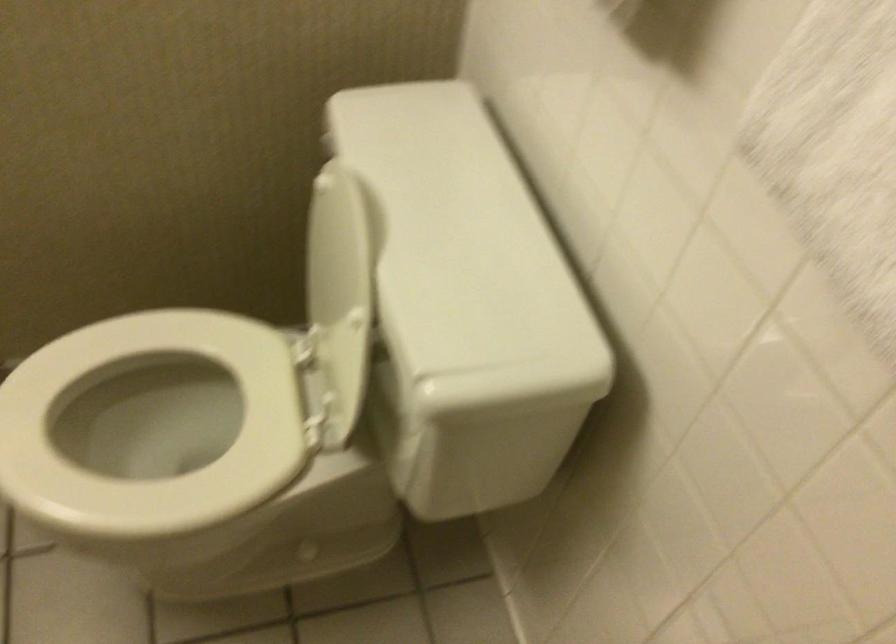
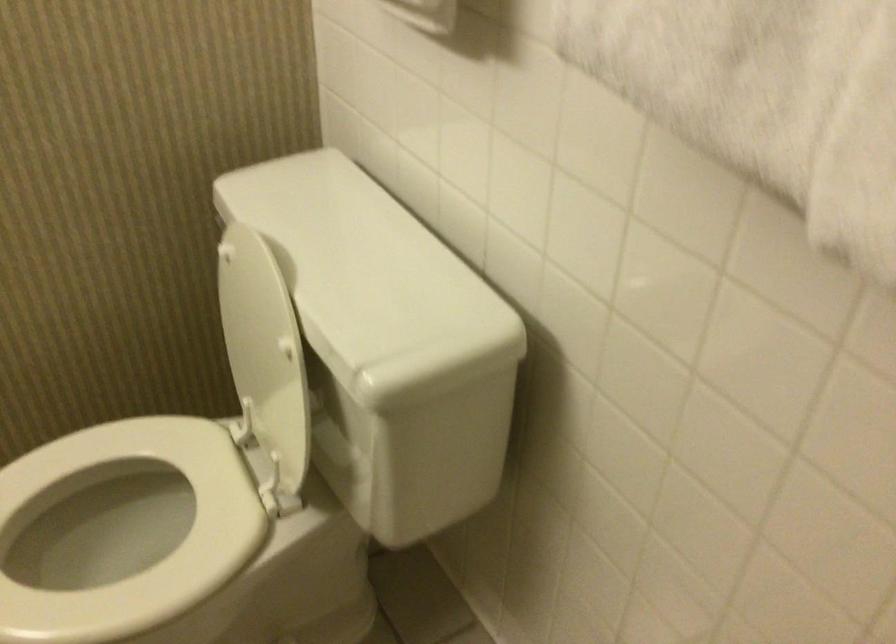
Locate, in the second image, the point that corresponds to (x=458, y=460) in the first image.

(411, 451)